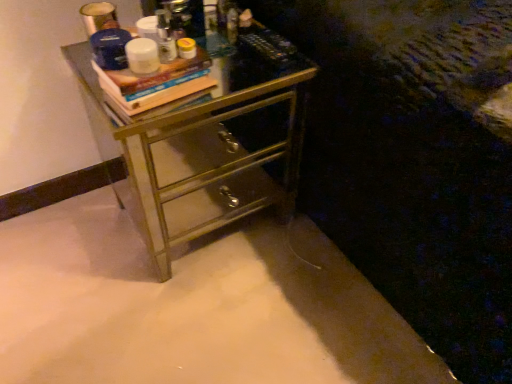
This screenshot has height=384, width=512. I want to click on empty space that is ontop of wooden book at upper center, so click(x=166, y=65).